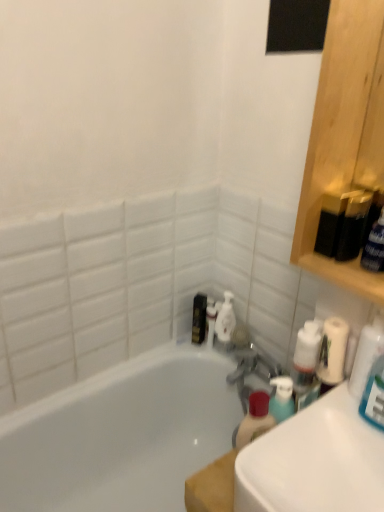
Question: From a real-world perspective, is white glossy sink at lower right physically above metallic gold toiletry at center, which is counted as the first toiletry, starting from the left?

Choices:
 (A) yes
 (B) no

Answer: (A)

Question: Is white glossy sink at lower right in front of metallic gold toiletry at center, which is counted as the first toiletry, starting from the left?

Choices:
 (A) yes
 (B) no

Answer: (A)

Question: Is white glossy sink at lower right aimed at metallic gold toiletry at center, which is counted as the first toiletry, starting from the left?

Choices:
 (A) yes
 (B) no

Answer: (B)

Question: Can you confirm if white glossy sink at lower right is positioned to the left of metallic gold toiletry at center, which is counted as the first toiletry, starting from the left?

Choices:
 (A) no
 (B) yes

Answer: (A)

Question: Considering the relative sizes of white glossy sink at lower right and metallic gold toiletry at center, acting as the second toiletry starting from the right, in the image provided, is white glossy sink at lower right wider than metallic gold toiletry at center, acting as the second toiletry starting from the right,?

Choices:
 (A) no
 (B) yes

Answer: (B)

Question: Is metallic gold toiletry at center, acting as the second toiletry starting from the right, at the back of white glossy sink at lower right?

Choices:
 (A) no
 (B) yes

Answer: (A)

Question: Is white glossy bathtub at center a part of metallic gold toiletry at center, which is counted as the first toiletry, starting from the left?

Choices:
 (A) no
 (B) yes

Answer: (A)

Question: Are metallic gold toiletry at center, which is counted as the first toiletry, starting from the left, and white glossy bathtub at center beside each other?

Choices:
 (A) no
 (B) yes

Answer: (A)

Question: Is metallic gold toiletry at center, which is counted as the first toiletry, starting from the left, shorter than white glossy bathtub at center?

Choices:
 (A) yes
 (B) no

Answer: (A)

Question: Is metallic gold toiletry at center, which is counted as the first toiletry, starting from the left, looking in the opposite direction of white glossy bathtub at center?

Choices:
 (A) no
 (B) yes

Answer: (A)

Question: Can you confirm if metallic gold toiletry at center, which is counted as the first toiletry, starting from the left, is bigger than white glossy bathtub at center?

Choices:
 (A) no
 (B) yes

Answer: (A)

Question: Can you confirm if metallic gold toiletry at center, acting as the second toiletry starting from the right, is smaller than white glossy bathtub at center?

Choices:
 (A) no
 (B) yes

Answer: (B)

Question: From the image's perspective, would you say white glossy sink at lower right is positioned over white glossy bathtub at center?

Choices:
 (A) yes
 (B) no

Answer: (A)